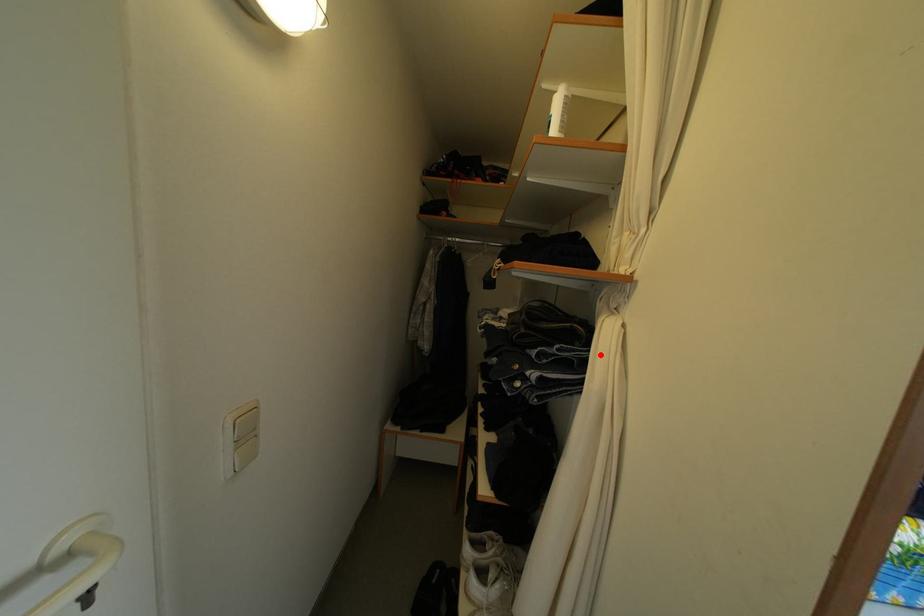
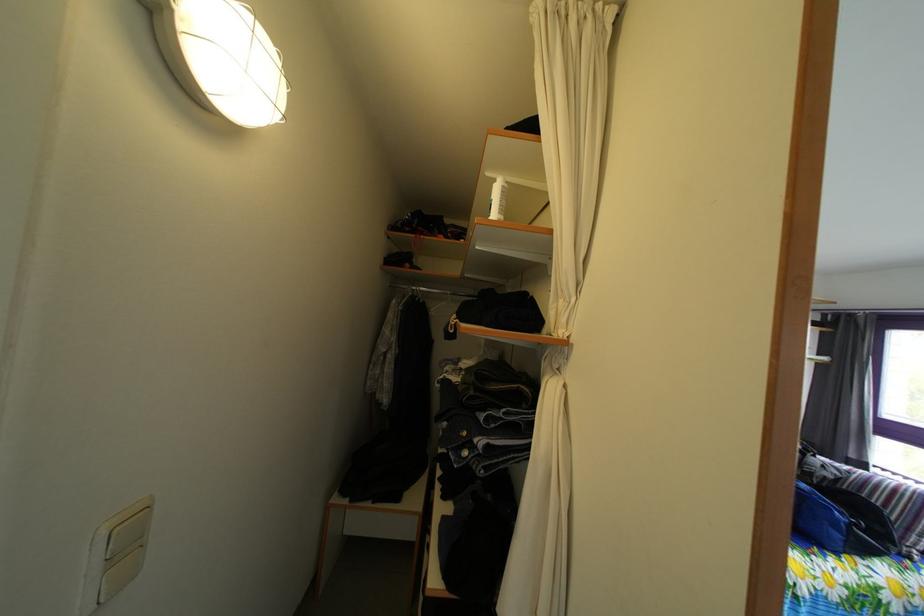
Where in the second image is the point corresponding to the highlighted location from the first image?

(545, 416)